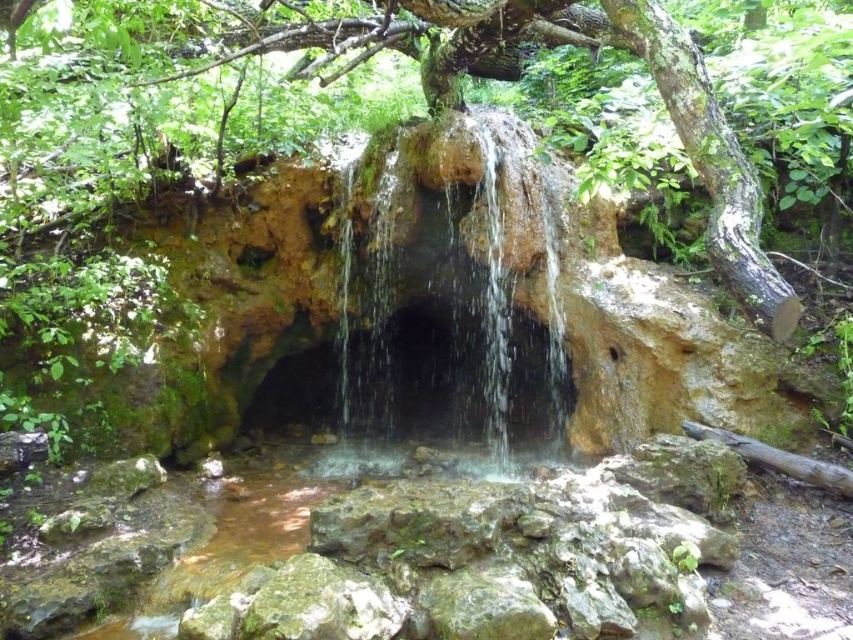
Locate an element on the screen. This screenshot has height=640, width=853. translucent rock waterfall at center is located at coordinates (465, 248).

Can you confirm if translucent rock waterfall at center is positioned above brown rough log at lower right?

Correct, translucent rock waterfall at center is located above brown rough log at lower right.

Who is more forward, (521, 428) or (751, 460)?

Positioned in front is point (751, 460).

Locate an element on the screen. translucent rock waterfall at center is located at coordinates (465, 248).

Which is behind, point (480, 397) or point (466, 13)?

The point (480, 397) is behind.

Is translucent rock waterfall at center closer to the viewer compared to green mossy tree at upper center?

No, it is not.

Is point (387, 147) closer to camera compared to point (692, 58)?

No.

Where is `translucent rock waterfall at center`? Image resolution: width=853 pixels, height=640 pixels. translucent rock waterfall at center is located at coordinates (465, 248).

Between green mossy tree at upper center and brown rough log at lower right, which one is positioned lower?

brown rough log at lower right is lower down.

Locate an element on the screen. green mossy tree at upper center is located at coordinates (665, 108).